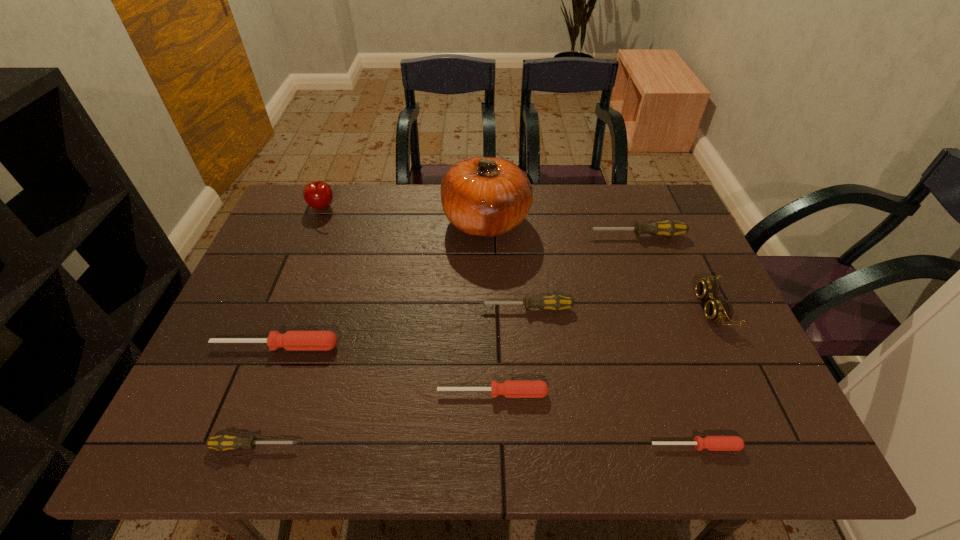
At what (x,y) coordinates should I click in order to perform the action: click on the second biggest red screwdriver. Please return your answer as a coordinate pair (x, y). Looking at the image, I should click on (509, 388).

You are a GUI agent. You are given a task and a screenshot of the screen. Output one action in this format:
    pyautogui.click(x=<x>, y=<y>)
    Task: Click on the second red screwdriver from right to left
    The image size is (960, 540).
    Given the screenshot: What is the action you would take?
    pyautogui.click(x=509, y=388)

You are a GUI agent. You are given a task and a screenshot of the screen. Output one action in this format:
    pyautogui.click(x=<x>, y=<y>)
    Task: Click on the nearest gray screwdriver
    The width and height of the screenshot is (960, 540).
    Given the screenshot: What is the action you would take?
    pyautogui.click(x=223, y=442)

I want to click on the smallest gray screwdriver, so click(x=223, y=442).

Identify the location of the shortest object. (713, 443).

The height and width of the screenshot is (540, 960). Identify the location of the shortest screwdriver. (713, 443).

The image size is (960, 540). Identify the location of free location located 0.190m on the front of the tallest object. (488, 301).

Identify the location of free space located on the front of the cherry. This screenshot has height=540, width=960. pyautogui.click(x=295, y=280).

Where is `free space located through the lenses of the goggles`? This screenshot has width=960, height=540. free space located through the lenses of the goggles is located at coordinates (586, 308).

Locate an element on the screen. The image size is (960, 540). free space located 0.240m through the lenses of the goggles is located at coordinates (605, 308).